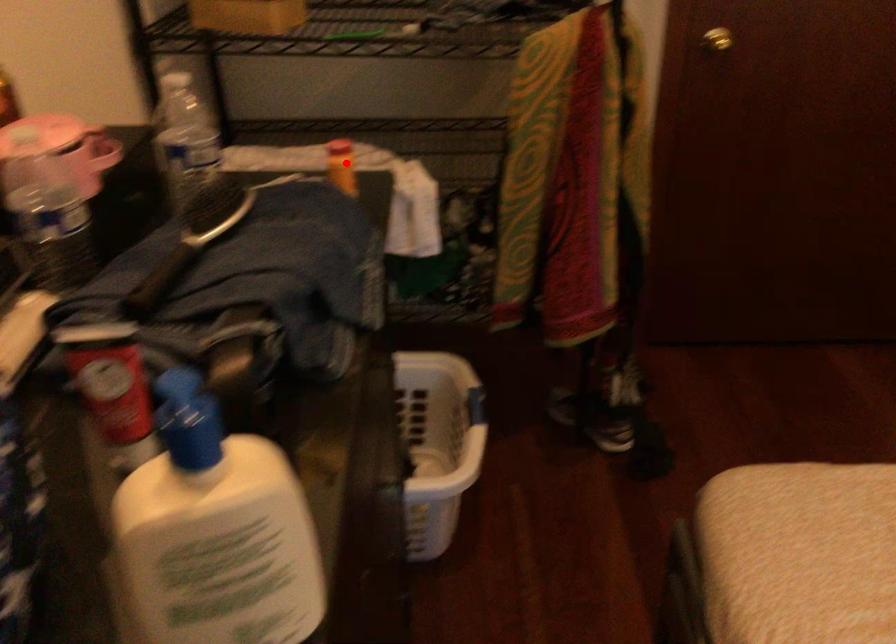
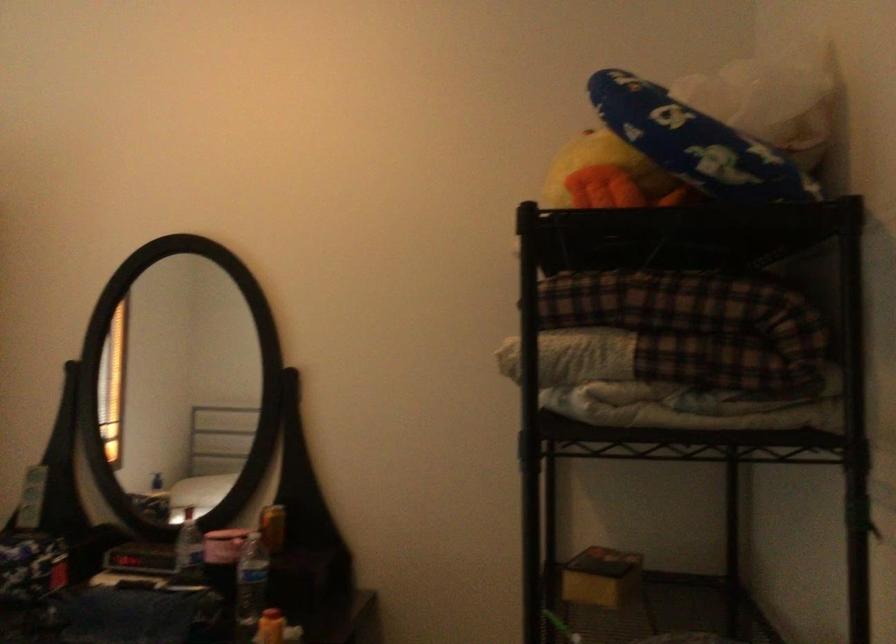
Question: I am providing you with two images of the same scene from different viewpoints. In image1, a red point is highlighted. Considering the same 3D point in image2, which of the following is correct?

Choices:
 (A) It is closer
 (B) It is farther

Answer: (B)